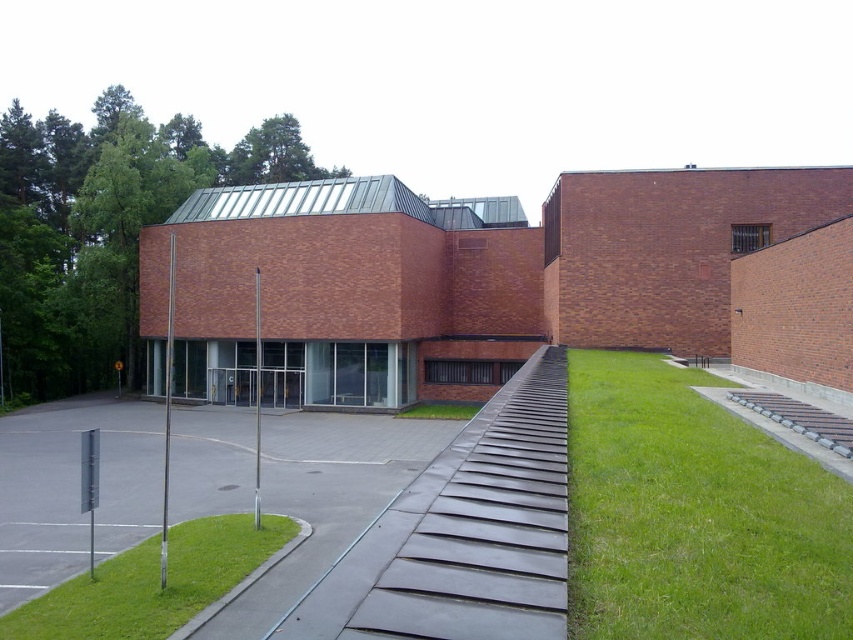
You are standing in front of the building and want to take a photo that includes both points mentioned. If you move closer to the point at point (805, 518), will the other point at point (469, 412) become more visible in your frame?

Moving closer to point (805, 518) will not necessarily make point (469, 412) more visible because proximity to one point doesn

You are a delivery person trying to park your van near the entrance of the building. The van requires a parking space that is at least 5 meters long. You see the gray concrete path at center and the green grass at lower left. Which area can accommodate the van?

The gray concrete path at center has a larger size compared to green grass at lower left, so the gray concrete path at center can accommodate the van as it is larger and more suitable for parking.

You are standing at the entrance of the modern architectural building and want to reach the gray concrete path at center. According to the image, which direction should you walk to find it?

The gray concrete path at center is located at point coordinates, so you should walk towards the center area to reach it.